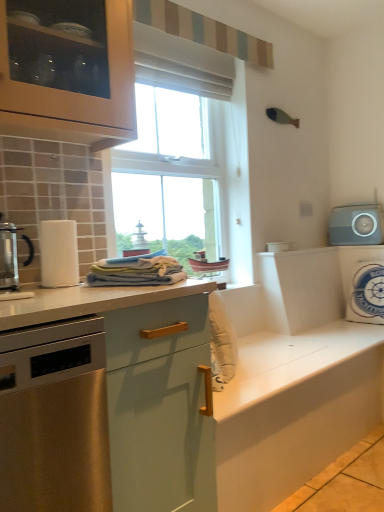
Question: Considering the relative sizes of metallic glass coffee maker at left and white matte cabinet at center in the image provided, is metallic glass coffee maker at left bigger than white matte cabinet at center?

Choices:
 (A) yes
 (B) no

Answer: (B)

Question: From a real-world perspective, is metallic glass coffee maker at left on white matte cabinet at center?

Choices:
 (A) no
 (B) yes

Answer: (B)

Question: Is metallic glass coffee maker at left placed right next to white matte cabinet at center?

Choices:
 (A) yes
 (B) no

Answer: (B)

Question: From the image's perspective, is metallic glass coffee maker at left beneath white matte cabinet at center?

Choices:
 (A) yes
 (B) no

Answer: (B)

Question: Is metallic glass coffee maker at left looking in the opposite direction of white matte cabinet at center?

Choices:
 (A) yes
 (B) no

Answer: (B)

Question: In terms of width, does gray matte speaker at upper right, positioned as the first appliance in top-to-bottom order, look wider or thinner when compared to white fabric pillow at right, positioned as the 2th appliance in right-to-left order?

Choices:
 (A) wide
 (B) thin

Answer: (B)

Question: Is gray matte speaker at upper right, which ranks as the third appliance in left-to-right order, to the left or to the right of white fabric pillow at right, positioned as the 1th appliance in bottom-to-top order, in the image?

Choices:
 (A) right
 (B) left

Answer: (A)

Question: From a real-world perspective, relative to white fabric pillow at right, which appears as the third appliance when viewed from the top, is gray matte speaker at upper right, positioned as the first appliance in top-to-bottom order, vertically above or below?

Choices:
 (A) above
 (B) below

Answer: (A)

Question: Is point (360, 211) positioned closer to the camera than point (352, 318)?

Choices:
 (A) closer
 (B) farther

Answer: (B)

Question: From a real-world perspective, is metallic glass coffee maker at left positioned above or below stainless steel dishwasher at left?

Choices:
 (A) above
 (B) below

Answer: (A)

Question: Would you say metallic glass coffee maker at left is to the left or to the right of stainless steel dishwasher at left in the picture?

Choices:
 (A) left
 (B) right

Answer: (A)

Question: Do you think metallic glass coffee maker at left is within stainless steel dishwasher at left, or outside of it?

Choices:
 (A) outside
 (B) inside

Answer: (A)

Question: From the image's perspective, is metallic glass coffee maker at left positioned above or below stainless steel dishwasher at left?

Choices:
 (A) above
 (B) below

Answer: (A)

Question: From the image's perspective, is white matte cabinet at center located above or below metallic glass coffee maker at left?

Choices:
 (A) above
 (B) below

Answer: (B)

Question: Considering the positions of white matte cabinet at center and metallic glass coffee maker at left in the image, is white matte cabinet at center wider or thinner than metallic glass coffee maker at left?

Choices:
 (A) wide
 (B) thin

Answer: (A)